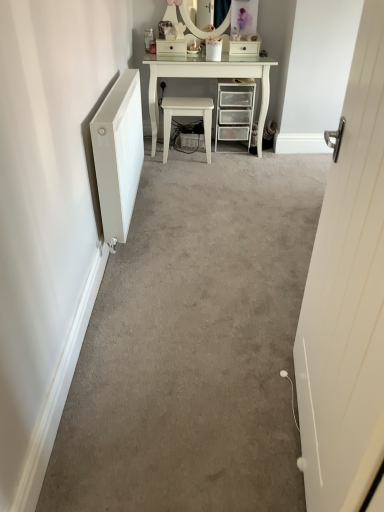
Question: From a real-world perspective, is white glossy drawer at upper center, acting as the 1th drawer starting from the left, positioned above or below white glossy drawer at upper center, acting as the 1th drawer starting from the right?

Choices:
 (A) below
 (B) above

Answer: (B)

Question: Is point (177, 49) closer or farther from the camera than point (241, 54)?

Choices:
 (A) farther
 (B) closer

Answer: (B)

Question: Which of these objects is positioned closest to the white wooden door at right?

Choices:
 (A) white glossy vanity at upper center
 (B) white glossy stool at center
 (C) white glossy drawer at upper center, acting as the 1th drawer starting from the right
 (D) white glossy drawer at upper center, arranged as the second drawer when viewed from the right
 (E) clear plastic drawers at center

Answer: (A)

Question: Considering the real-world distances, which object is farthest from the white glossy drawer at upper center, the 2th drawer viewed from the left?

Choices:
 (A) white glossy drawer at upper center, arranged as the second drawer when viewed from the right
 (B) white glossy vanity at upper center
 (C) white glossy stool at center
 (D) white wooden door at right
 (E) clear plastic drawers at center

Answer: (D)